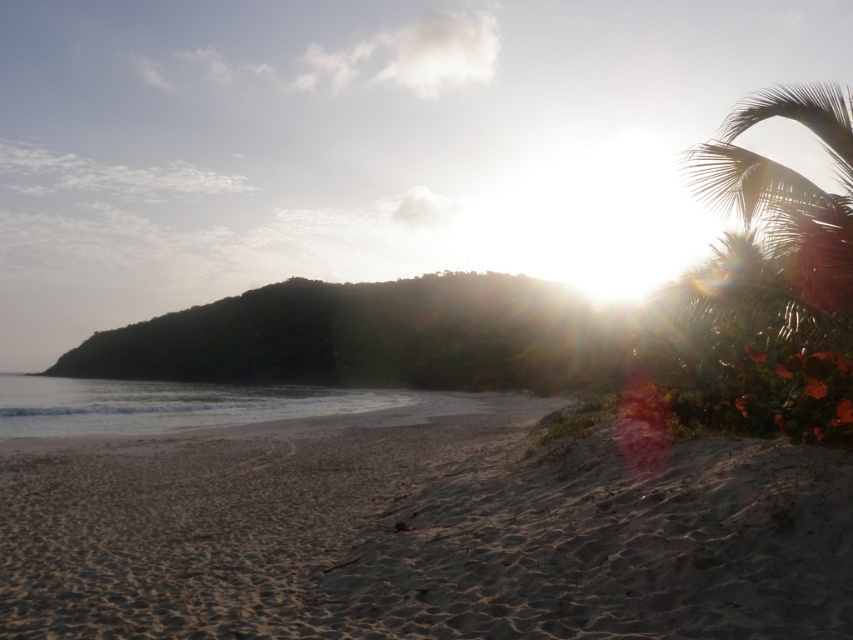
Does sandy beach at lower left have a lesser height compared to green leafy palm tree at upper right?

Yes, sandy beach at lower left is shorter than green leafy palm tree at upper right.

Locate an element on the screen. This screenshot has width=853, height=640. sandy beach at lower left is located at coordinates (399, 522).